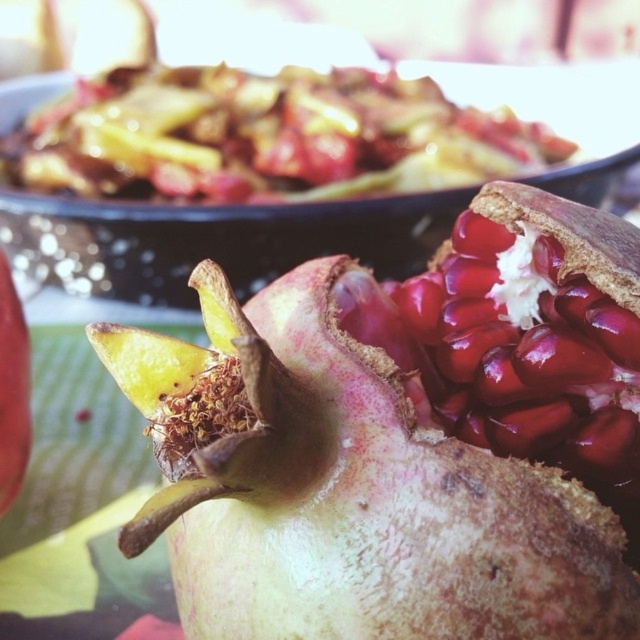
Measure the distance between point (332, 321) and camera.

They are 27.00 inches apart.

Is point (227, 541) less distant than point (173, 131)?

Yes, point (227, 541) is in front of point (173, 131).

Who is more distant from viewer, (x=611, y=243) or (x=552, y=132)?

Positioned behind is point (x=552, y=132).

Locate an element on the screen. Image resolution: width=640 pixels, height=640 pixels. greenish-brown textured pomegranate at center is located at coordinates 368,502.